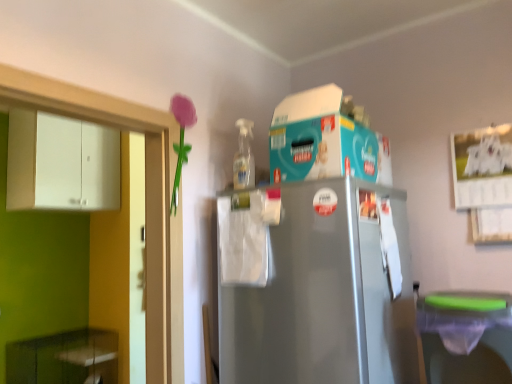
Question: From the image's perspective, is matte plastic flower at upper left located above or below white matte cabinet at left, which is the 2th cabinetry from bottom to top?

Choices:
 (A) below
 (B) above

Answer: (A)

Question: Looking at the image, does matte plastic flower at upper left seem bigger or smaller compared to white matte cabinet at left, which is the 2th cabinetry from bottom to top?

Choices:
 (A) small
 (B) big

Answer: (A)

Question: Which object is positioned closest to the white matte cabinet at left, the first cabinetry in the top-to-bottom sequence?

Choices:
 (A) matte plastic flower at upper left
 (B) green plastic dish washer at lower right
 (C) teal cardboard box at upper center
 (D) green glossy cabinet at lower left, marked as the first cabinetry in a bottom-to-top arrangement

Answer: (D)

Question: Based on their relative distances, which object is farther from the teal cardboard box at upper center?

Choices:
 (A) green glossy cabinet at lower left, marked as the first cabinetry in a bottom-to-top arrangement
 (B) matte plastic flower at upper left
 (C) green plastic dish washer at lower right
 (D) white matte cabinet at left, the first cabinetry in the top-to-bottom sequence

Answer: (A)